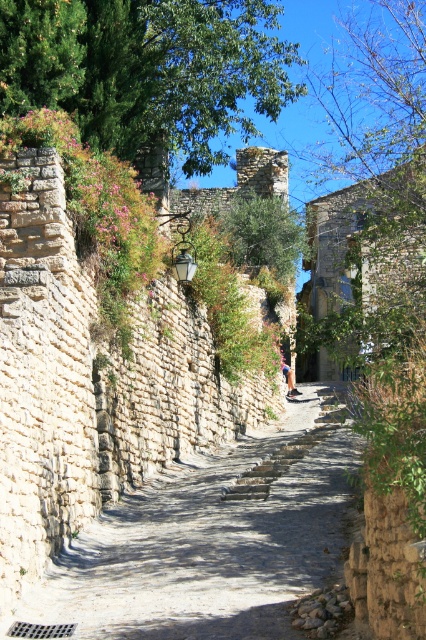
Question: Which point is farther to the camera?

Choices:
 (A) smooth stone path at center
 (B) green leafy tree at upper left

Answer: (B)

Question: In this image, where is smooth stone path at center located relative to green leafy tree at upper left?

Choices:
 (A) below
 (B) above

Answer: (A)

Question: Is smooth stone path at center wider than green leafy tree at upper left?

Choices:
 (A) no
 (B) yes

Answer: (A)

Question: In this image, where is smooth stone path at center located relative to green leafy tree at upper left?

Choices:
 (A) above
 (B) below

Answer: (B)